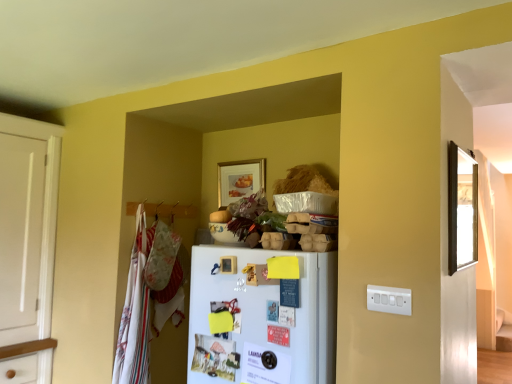
At what (x,y) coordinates should I click in order to perform the action: click on white plastic switch plate at lower right. Please return your answer as a coordinate pair (x, y). This screenshot has height=384, width=512. Looking at the image, I should click on (389, 300).

This screenshot has height=384, width=512. Describe the element at coordinates (240, 180) in the screenshot. I see `matte wooden picture frame at upper center, the 2th picture frame viewed from the right` at that location.

This screenshot has height=384, width=512. What do you see at coordinates (462, 208) in the screenshot?
I see `wooden mirror at right, positioned as the 2th picture frame in left-to-right order` at bounding box center [462, 208].

At what (x,y) coordinates should I click in order to perform the action: click on wooden mirror at right, marked as the 2th picture frame in a back-to-front arrangement. Please return your answer as a coordinate pair (x, y). Image resolution: width=512 pixels, height=384 pixels. Looking at the image, I should click on (462, 208).

This screenshot has height=384, width=512. What are the coordinates of `white plastic switch plate at lower right` in the screenshot? It's located at (389, 300).

Does point (125, 366) appear closer or farther from the camera than point (226, 193)?

Point (125, 366).

Considering the relative positions of white cotton laundry at left and matte wooden picture frame at upper center, the first picture frame in the left-to-right sequence, in the image provided, is white cotton laundry at left to the right of matte wooden picture frame at upper center, the first picture frame in the left-to-right sequence, from the viewer's perspective?

No, white cotton laundry at left is not to the right of matte wooden picture frame at upper center, the first picture frame in the left-to-right sequence.

Considering the sizes of objects white cotton laundry at left and matte wooden picture frame at upper center, the first picture frame in the left-to-right sequence, in the image provided, who is taller, white cotton laundry at left or matte wooden picture frame at upper center, the first picture frame in the left-to-right sequence,?

With more height is white cotton laundry at left.

Is white cotton laundry at left positioned in front of matte wooden picture frame at upper center, the first picture frame in the left-to-right sequence?

That is True.

Is white plastic switch plate at lower right looking in the opposite direction of matte wooden picture frame at upper center, the 2th picture frame viewed from the right?

white plastic switch plate at lower right does not have its back to matte wooden picture frame at upper center, the 2th picture frame viewed from the right.

From the image's perspective, which is below, white plastic switch plate at lower right or matte wooden picture frame at upper center, positioned as the second picture frame in front-to-back order?

white plastic switch plate at lower right, from the image's perspective.

Which is behind, point (378, 293) or point (232, 188)?

Positioned behind is point (232, 188).

How distant is white plastic switch plate at lower right from matte wooden picture frame at upper center, the first picture frame in the left-to-right sequence?

white plastic switch plate at lower right and matte wooden picture frame at upper center, the first picture frame in the left-to-right sequence, are 1.20 meters apart.

From the image's perspective, which one is positioned higher, white plastic switch plate at lower right or white matte refrigerator at center?

white plastic switch plate at lower right appears higher in the image.

Between white plastic switch plate at lower right and white matte refrigerator at center, which one appears on the left side from the viewer's perspective?

Positioned to the left is white matte refrigerator at center.

Between white plastic switch plate at lower right and white matte refrigerator at center, which one has less height?

white plastic switch plate at lower right.

Considering the positions of objects white plastic switch plate at lower right and white cotton laundry at left in the image provided, who is behind, white plastic switch plate at lower right or white cotton laundry at left?

white cotton laundry at left is more distant.

Is there a large distance between white plastic switch plate at lower right and white cotton laundry at left?

Yes.

This screenshot has height=384, width=512. In order to click on electric outlet that appears in front of the white cotton laundry at left in this screenshot , I will do `click(389, 300)`.

Is white matte refrigerator at center placed right next to matte wooden picture frame at upper center, the first picture frame in the left-to-right sequence?

No, white matte refrigerator at center is not in contact with matte wooden picture frame at upper center, the first picture frame in the left-to-right sequence.

In terms of width, does white matte refrigerator at center look wider or thinner when compared to matte wooden picture frame at upper center, positioned as the second picture frame in front-to-back order?

Considering their sizes, white matte refrigerator at center looks broader than matte wooden picture frame at upper center, positioned as the second picture frame in front-to-back order.

Considering the positions of points (191, 297) and (219, 205), is point (191, 297) closer to camera compared to point (219, 205)?

Yes.

From the image's perspective, is white matte refrigerator at center beneath matte wooden picture frame at upper center, the 2th picture frame viewed from the right?

Yes, from the image's perspective, white matte refrigerator at center is below matte wooden picture frame at upper center, the 2th picture frame viewed from the right.

From the image's perspective, which one is positioned lower, matte wooden picture frame at upper center, positioned as the second picture frame in front-to-back order, or white matte refrigerator at center?

white matte refrigerator at center, from the image's perspective.

Is white matte refrigerator at center surrounded by matte wooden picture frame at upper center, positioned as the second picture frame in front-to-back order?

No, white matte refrigerator at center is not surrounded by matte wooden picture frame at upper center, positioned as the second picture frame in front-to-back order.

Can you confirm if matte wooden picture frame at upper center, the first picture frame in the left-to-right sequence, is positioned to the left of white matte refrigerator at center?

Correct, you'll find matte wooden picture frame at upper center, the first picture frame in the left-to-right sequence, to the left of white matte refrigerator at center.

Locate an element on the screen. This screenshot has height=384, width=512. refrigerator that is under the matte wooden picture frame at upper center, arranged as the 1th picture frame when viewed from the back (from a real-world perspective) is located at coordinates (262, 319).

Locate an element on the screen. This screenshot has width=512, height=384. electric outlet located underneath the wooden mirror at right, placed as the first picture frame when sorted from front to back (from a real-world perspective) is located at coordinates (389, 300).

In the scene shown: Can you confirm if white plastic switch plate at lower right is taller than wooden mirror at right, the 1th picture frame viewed from the right?

Incorrect, the height of white plastic switch plate at lower right is not larger of that of wooden mirror at right, the 1th picture frame viewed from the right.

Is white plastic switch plate at lower right placed right next to wooden mirror at right, marked as the 2th picture frame in a back-to-front arrangement?

white plastic switch plate at lower right and wooden mirror at right, marked as the 2th picture frame in a back-to-front arrangement, are clearly separated.

From the image's perspective, is white plastic switch plate at lower right above or below wooden mirror at right, the 1th picture frame viewed from the right?

Based on their image positions, white plastic switch plate at lower right is located beneath wooden mirror at right, the 1th picture frame viewed from the right.

Find the location of a particular element. laundry in front of the matte wooden picture frame at upper center, the 2th picture frame viewed from the right is located at coordinates (148, 298).

The width and height of the screenshot is (512, 384). I want to click on the 2nd picture frame behind the white plastic switch plate at lower right, starting your count from the anchor, so click(x=240, y=180).

Estimate the real-world distances between objects in this image. Which object is further from white matte refrigerator at center, matte wooden picture frame at upper center, the 2th picture frame viewed from the right, or wooden mirror at right, positioned as the 2th picture frame in left-to-right order?

The object further to white matte refrigerator at center is matte wooden picture frame at upper center, the 2th picture frame viewed from the right.

Considering their positions, is wooden mirror at right, marked as the 2th picture frame in a back-to-front arrangement, positioned closer to matte wooden picture frame at upper center, the 2th picture frame viewed from the right, than white cotton laundry at left?

white cotton laundry at left.

Looking at the image, which one is located further to wooden mirror at right, marked as the 2th picture frame in a back-to-front arrangement, matte wooden picture frame at upper center, the 2th picture frame viewed from the right, or white matte refrigerator at center?

Among the two, matte wooden picture frame at upper center, the 2th picture frame viewed from the right, is located further to wooden mirror at right, marked as the 2th picture frame in a back-to-front arrangement.

Which object lies nearer to the anchor point wooden mirror at right, the 1th picture frame viewed from the right, white matte refrigerator at center or white cotton laundry at left?

The object closer to wooden mirror at right, the 1th picture frame viewed from the right, is white matte refrigerator at center.

Consider the image. Which object lies further to the anchor point white matte refrigerator at center, matte wooden picture frame at upper center, arranged as the 1th picture frame when viewed from the back, or white plastic switch plate at lower right?

matte wooden picture frame at upper center, arranged as the 1th picture frame when viewed from the back, is positioned further to the anchor white matte refrigerator at center.

Based on their spatial positions, is white matte refrigerator at center or white cotton laundry at left further from white plastic switch plate at lower right?

Among the two, white cotton laundry at left is located further to white plastic switch plate at lower right.

Based on their spatial positions, is white cotton laundry at left or wooden mirror at right, placed as the first picture frame when sorted from front to back, further from white matte refrigerator at center?

white cotton laundry at left.

When comparing their distances from wooden mirror at right, positioned as the 2th picture frame in left-to-right order, does white matte refrigerator at center or matte wooden picture frame at upper center, positioned as the second picture frame in front-to-back order, seem further?

The object further to wooden mirror at right, positioned as the 2th picture frame in left-to-right order, is matte wooden picture frame at upper center, positioned as the second picture frame in front-to-back order.

The image size is (512, 384). I want to click on refrigerator situated between white cotton laundry at left and white plastic switch plate at lower right from left to right, so click(262, 319).

You are a GUI agent. You are given a task and a screenshot of the screen. Output one action in this format:
    pyautogui.click(x=<x>, y=<y>)
    Task: Click on the picture frame between white cotton laundry at left and wooden mirror at right, the 1th picture frame viewed from the right
    This screenshot has height=384, width=512.
    Given the screenshot: What is the action you would take?
    pyautogui.click(x=240, y=180)

At what (x,y) coordinates should I click in order to perform the action: click on picture frame located between white cotton laundry at left and white plastic switch plate at lower right in the left-right direction. Please return your answer as a coordinate pair (x, y). Image resolution: width=512 pixels, height=384 pixels. Looking at the image, I should click on (240, 180).

Identify the location of refrigerator positioned between white plastic switch plate at lower right and matte wooden picture frame at upper center, the first picture frame in the left-to-right sequence, from near to far. The height and width of the screenshot is (384, 512). (262, 319).